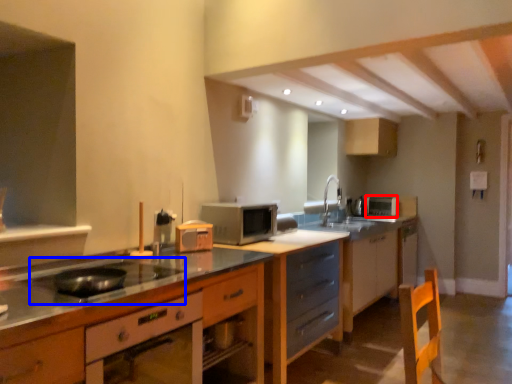
Question: Which point is further to the camera, appliance (highlighted by a red box) or gas stove (highlighted by a blue box)?

Choices:
 (A) appliance
 (B) gas stove

Answer: (A)